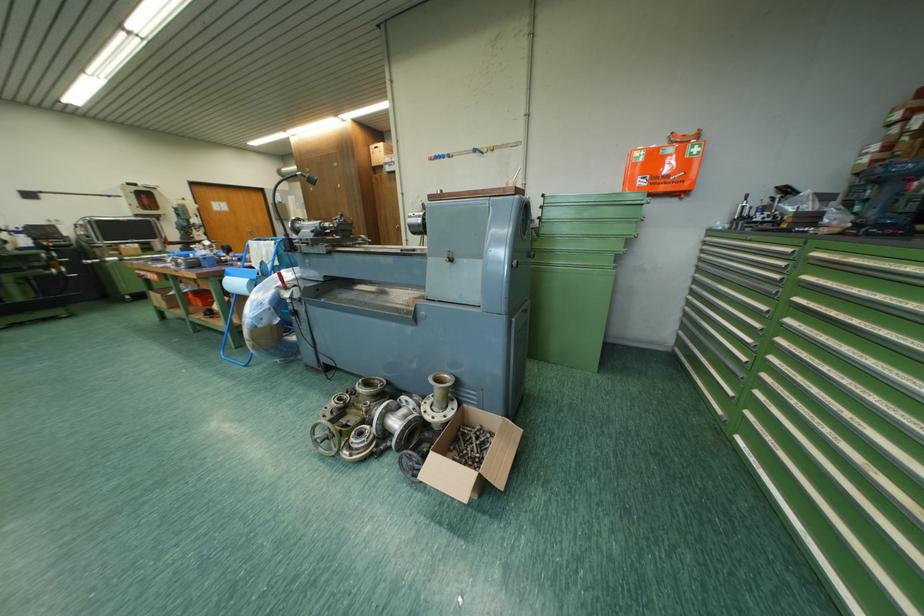
Where would you lift the cardboard box? Please return your answer as a coordinate pair (x, y).

(470, 456)